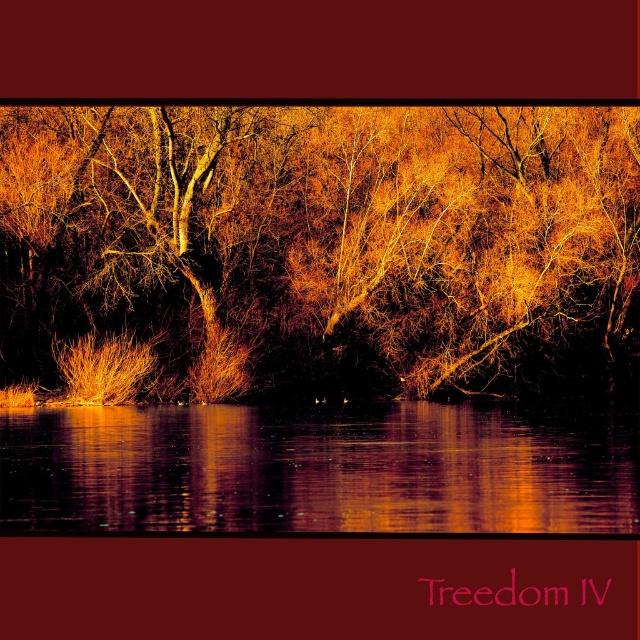
Question: Which of the following is the farthest from the observer?

Choices:
 (A) golden textured tree at center
 (B) reflective water at center

Answer: (A)

Question: Is golden textured tree at center below reflective water at center?

Choices:
 (A) yes
 (B) no

Answer: (B)

Question: Is the position of golden textured tree at center more distant than that of reflective water at center?

Choices:
 (A) yes
 (B) no

Answer: (A)

Question: Can you confirm if golden textured tree at center is wider than reflective water at center?

Choices:
 (A) yes
 (B) no

Answer: (A)

Question: Which point is farther to the camera?

Choices:
 (A) golden textured tree at center
 (B) reflective water at center

Answer: (A)